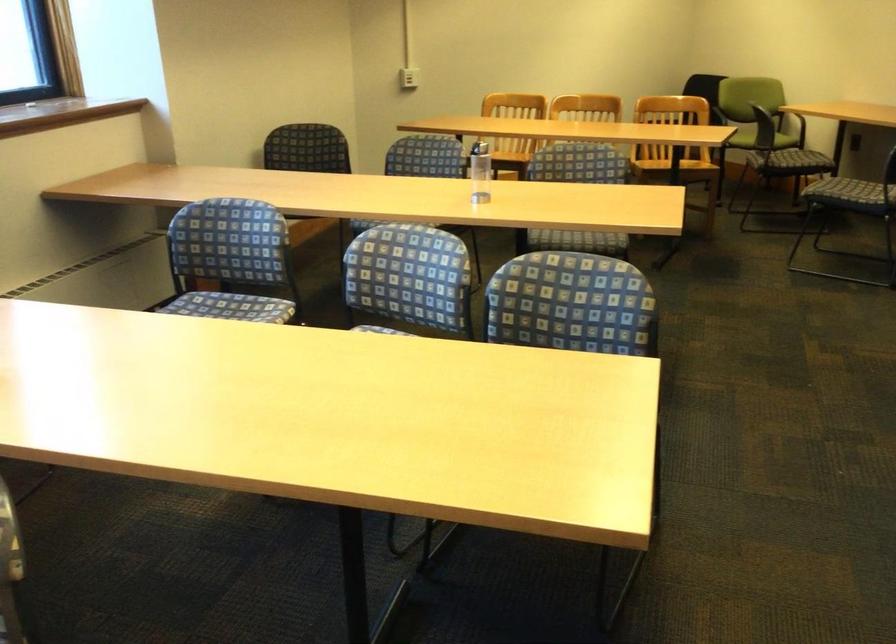
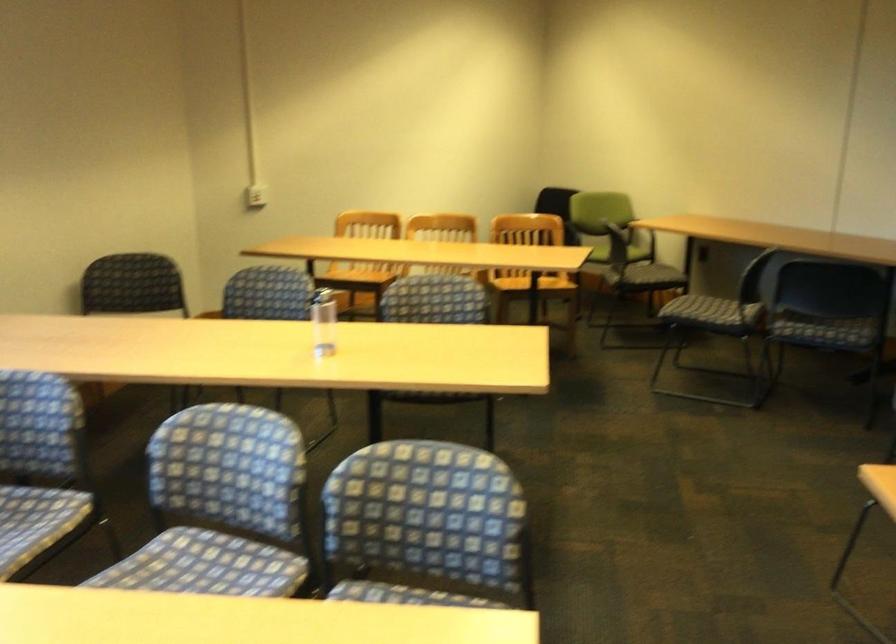
Find the pixel in the second image that matches [481,167] in the first image.

(323, 322)